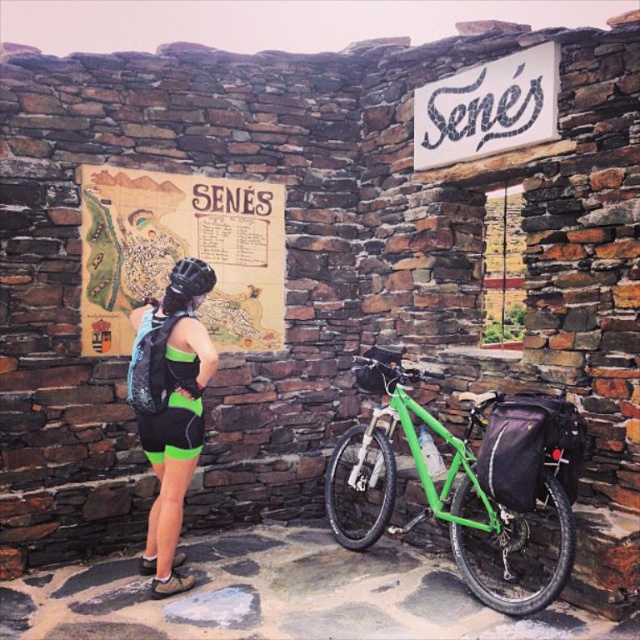
You are a cyclist at the checkpoint and need to place both the green matte bicycle at center and the black matte bicycle helmet at center on a 1.2 meter wide rack. Can both items fit side by side without overlapping?

The green matte bicycle at center is wider than the black matte bicycle helmet at center. Since the rack is 1.2 meters wide, it depends on the combined width of both items. However, without knowing their exact dimensions, we cannot definitively say if they will fit. Please measure both items to ensure they fit within the rack.

You are a cyclist who just arrived at the checkpoint. You see a green matte bicycle at center and a wooden map at center. Which object is closer to you?

The green matte bicycle at center is closer to you because it is positioned under the wooden map at center, meaning the bicycle is in front of the map.

You are a cyclist who just arrived at the checkpoint. You see a green matte bicycle at center and a wooden map at center. Which object is closer to your right side?

The green matte bicycle at center is to the right of the wooden map at center, so the green matte bicycle at center is closer to your right side.